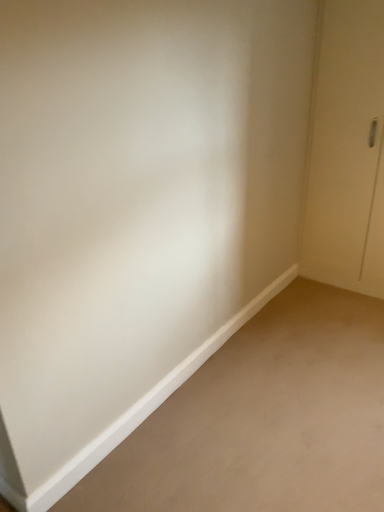
Identify the location of empty space that is ontop of white matte baseboard at lower left (from a real-world perspective). pyautogui.click(x=267, y=395).